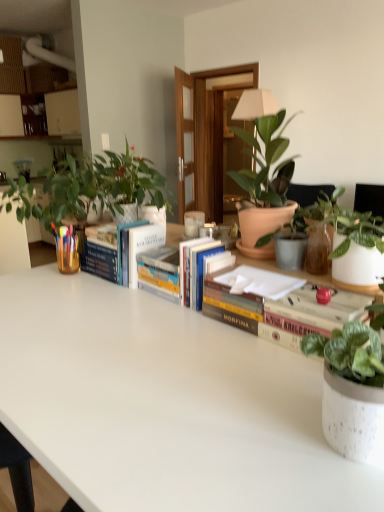
Question: Which direction should I rotate to look at hardcover book at center, which is the 1th book in left-to-right order, — up or down?

Choices:
 (A) down
 (B) up

Answer: (B)

Question: From a real-world perspective, is green matte plant at upper left, which is the 2th houseplant in left-to-right order, on top of speckled ceramic pot at lower right, the 2th houseplant positioned from the right?

Choices:
 (A) no
 (B) yes

Answer: (B)

Question: From a real-world perspective, does green matte plant at upper left, positioned as the fifth houseplant in right-to-left order, sit lower than speckled ceramic pot at lower right, the 2th houseplant positioned from the right?

Choices:
 (A) no
 (B) yes

Answer: (A)

Question: Is speckled ceramic pot at lower right, the 2th houseplant positioned from the right, surrounded by green matte plant at upper left, positioned as the fifth houseplant in right-to-left order?

Choices:
 (A) no
 (B) yes

Answer: (A)

Question: Is green matte plant at upper left, which is the 2th houseplant in left-to-right order, far from speckled ceramic pot at lower right, the 2th houseplant positioned from the right?

Choices:
 (A) no
 (B) yes

Answer: (B)

Question: Considering the relative positions of green matte plant at upper left, positioned as the fifth houseplant in right-to-left order, and speckled ceramic pot at lower right, the 2th houseplant positioned from the right, in the image provided, is green matte plant at upper left, positioned as the fifth houseplant in right-to-left order, to the left of speckled ceramic pot at lower right, the 2th houseplant positioned from the right, from the viewer's perspective?

Choices:
 (A) yes
 (B) no

Answer: (A)

Question: From the image's perspective, is green matte plant at upper left, positioned as the fifth houseplant in right-to-left order, beneath speckled ceramic pot at lower right, the 2th houseplant positioned from the right?

Choices:
 (A) no
 (B) yes

Answer: (A)

Question: Is terracotta pot at center, placed as the fourth houseplant when sorted from left to right, positioned with its back to green matte plant at left, which appears as the 6th houseplant when viewed from the right?

Choices:
 (A) yes
 (B) no

Answer: (A)

Question: Is terracotta pot at center, placed as the fourth houseplant when sorted from left to right, positioned behind green matte plant at left, which appears as the 6th houseplant when viewed from the right?

Choices:
 (A) no
 (B) yes

Answer: (A)

Question: From a real-world perspective, is terracotta pot at center, placed as the fourth houseplant when sorted from left to right, on top of green matte plant at left, arranged as the 1th houseplant when viewed from the left?

Choices:
 (A) yes
 (B) no

Answer: (B)

Question: Is green matte plant at left, arranged as the 1th houseplant when viewed from the left, a part of terracotta pot at center, placed as the fourth houseplant when sorted from left to right?

Choices:
 (A) no
 (B) yes

Answer: (A)

Question: From a real-world perspective, is terracotta pot at center, positioned as the third houseplant in right-to-left order, positioned under green matte plant at left, which appears as the 6th houseplant when viewed from the right, based on gravity?

Choices:
 (A) no
 (B) yes

Answer: (B)

Question: Does terracotta pot at center, positioned as the third houseplant in right-to-left order, appear on the right side of green matte plant at left, which appears as the 6th houseplant when viewed from the right?

Choices:
 (A) no
 (B) yes

Answer: (B)

Question: From the image's perspective, is speckled white pot at upper right, the first houseplant positioned from the right, above white matte table at center?

Choices:
 (A) no
 (B) yes

Answer: (B)